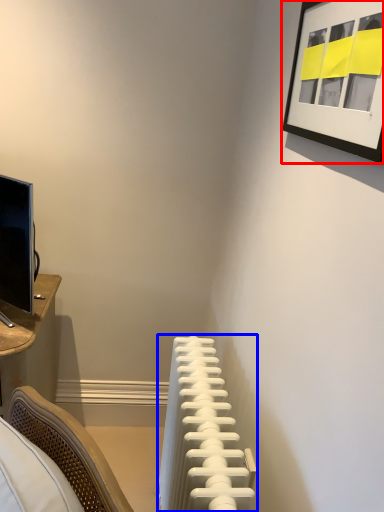
Question: Which object is closer to the camera taking this photo, picture frame (highlighted by a red box) or radiator (highlighted by a blue box)?

Choices:
 (A) picture frame
 (B) radiator

Answer: (A)